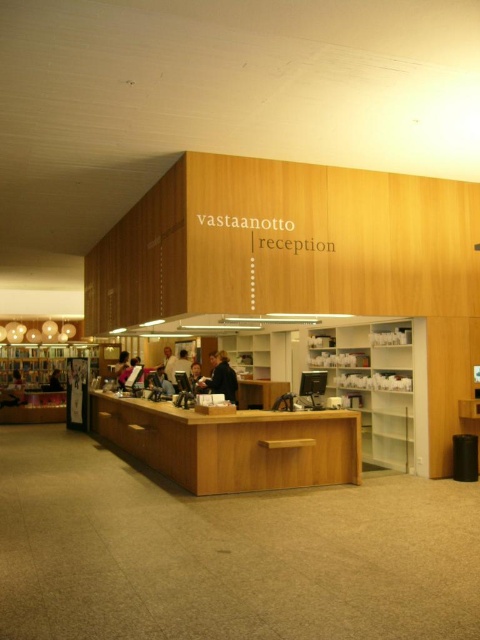
Measure the distance between dark brown leather jacket at center and matte black person at lower left.

A distance of 21.60 feet exists between dark brown leather jacket at center and matte black person at lower left.

Can you confirm if dark brown leather jacket at center is smaller than matte black person at lower left?

Correct, dark brown leather jacket at center occupies less space than matte black person at lower left.

Who is more forward, (192, 371) or (56, 378)?

Point (192, 371)

This screenshot has width=480, height=640. Identify the location of dark brown leather jacket at center. (196, 378).

Between dark blue jacket at center and matte black person at lower left, which one has less height?

matte black person at lower left is shorter.

Is dark blue jacket at center smaller than matte black person at lower left?

No, dark blue jacket at center is not smaller than matte black person at lower left.

You are a GUI agent. You are given a task and a screenshot of the screen. Output one action in this format:
    pyautogui.click(x=<x>, y=<y>)
    Task: Click on the dark blue jacket at center
    
    Given the screenshot: What is the action you would take?
    pyautogui.click(x=220, y=378)

Find the location of a particular element. dark blue jacket at center is located at coordinates (220, 378).

Can you confirm if light brown leather jacket at center is thinner than light brown hair at center?

Yes.

Where is `light brown leather jacket at center`? The image size is (480, 640). light brown leather jacket at center is located at coordinates [x=180, y=364].